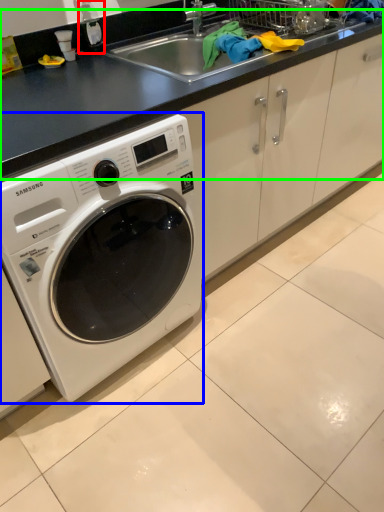
Question: Estimate the real-world distances between objects in this image. Which object is farther from bottle (highlighted by a red box), washing machine (highlighted by a blue box) or counter top (highlighted by a green box)?

Choices:
 (A) washing machine
 (B) counter top

Answer: (A)